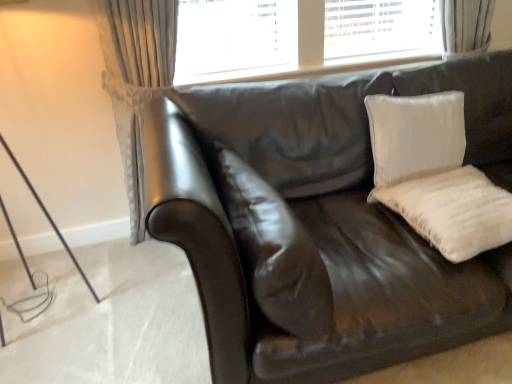
What do you see at coordinates (273, 249) in the screenshot? Image resolution: width=512 pixels, height=384 pixels. I see `satin brown pillow at center, which ranks as the third pillow in right-to-left order` at bounding box center [273, 249].

In order to face white cotton pillow at right, which appears as the 1th pillow when viewed from the right, should I rotate leftwards or rightwards?

You should look right and rotate roughly 26.079 degrees.

Identify the location of white cotton pillow at right, which appears as the 1th pillow when viewed from the right. The image size is (512, 384). (453, 211).

The width and height of the screenshot is (512, 384). Describe the element at coordinates (415, 136) in the screenshot. I see `white textured pillow at upper right, which ranks as the 2th pillow in right-to-left order` at that location.

Identify the location of satin brown pillow at center, which ranks as the third pillow in right-to-left order. This screenshot has width=512, height=384. (273, 249).

Where is `pillow below the white cotton pillow at right, which appears as the 1th pillow when viewed from the right (from the image's perspective)`? pillow below the white cotton pillow at right, which appears as the 1th pillow when viewed from the right (from the image's perspective) is located at coordinates (273, 249).

Is white cotton pillow at right, the 3th pillow when ordered from left to right, behind satin brown pillow at center, which ranks as the third pillow in right-to-left order?

Yes, it is behind satin brown pillow at center, which ranks as the third pillow in right-to-left order.

Considering the relative sizes of white cotton pillow at right, which appears as the 1th pillow when viewed from the right, and satin brown pillow at center, the 1th pillow from the left, in the image provided, is white cotton pillow at right, which appears as the 1th pillow when viewed from the right, thinner than satin brown pillow at center, the 1th pillow from the left,?

No.

Is point (443, 214) closer or farther from the camera than point (300, 328)?

Point (443, 214) appears to be farther away from the viewer than point (300, 328).

Is shiny brown leather couch at center surrounding white cotton pillow at right, which appears as the 1th pillow when viewed from the right?

Yes, white cotton pillow at right, which appears as the 1th pillow when viewed from the right, is a part of shiny brown leather couch at center.

Looking at this image, does shiny brown leather couch at center appear on the right side of white cotton pillow at right, which appears as the 1th pillow when viewed from the right?

Incorrect, shiny brown leather couch at center is not on the right side of white cotton pillow at right, which appears as the 1th pillow when viewed from the right.

What's the angular difference between shiny brown leather couch at center and white cotton pillow at right, the 3th pillow when ordered from left to right,'s facing directions?

shiny brown leather couch at center and white cotton pillow at right, the 3th pillow when ordered from left to right, are facing 2.5e-05 degrees away from each other.

Is shiny brown leather couch at center behind white cotton pillow at right, which appears as the 1th pillow when viewed from the right?

No, shiny brown leather couch at center is closer to the viewer.

The image size is (512, 384). Find the location of `studio couch that appears above the white cotton pillow at right, the 3th pillow when ordered from left to right (from the image's perspective)`. studio couch that appears above the white cotton pillow at right, the 3th pillow when ordered from left to right (from the image's perspective) is located at coordinates (353, 216).

Looking at the image, does white cotton pillow at right, which appears as the 1th pillow when viewed from the right, seem bigger or smaller compared to shiny brown leather couch at center?

Considering their sizes, white cotton pillow at right, which appears as the 1th pillow when viewed from the right, takes up less space than shiny brown leather couch at center.

From a real-world perspective, is white cotton pillow at right, which appears as the 1th pillow when viewed from the right, physically above shiny brown leather couch at center?

Yes, from a real-world perspective, white cotton pillow at right, which appears as the 1th pillow when viewed from the right, is above shiny brown leather couch at center.

Is shiny brown leather couch at center located outside white textured pillow at upper right, which ranks as the 2th pillow in right-to-left order?

shiny brown leather couch at center lies outside white textured pillow at upper right, which ranks as the 2th pillow in right-to-left order,'s area.

Which of these two, shiny brown leather couch at center or white textured pillow at upper right, which ranks as the 2th pillow in right-to-left order, stands taller?

Standing taller between the two is shiny brown leather couch at center.

Who is smaller, shiny brown leather couch at center or white textured pillow at upper right, which ranks as the 2th pillow in right-to-left order?

Smaller between the two is white textured pillow at upper right, which ranks as the 2th pillow in right-to-left order.

Would you say white textured pillow at upper right, acting as the 2th pillow starting from the left, is to the left or to the right of satin brown pillow at center, which ranks as the third pillow in right-to-left order, in the picture?

In the image, white textured pillow at upper right, acting as the 2th pillow starting from the left, appears on the right side of satin brown pillow at center, which ranks as the third pillow in right-to-left order.

How many degrees apart are the facing directions of white textured pillow at upper right, which ranks as the 2th pillow in right-to-left order, and satin brown pillow at center, which ranks as the third pillow in right-to-left order?

The facing directions of white textured pillow at upper right, which ranks as the 2th pillow in right-to-left order, and satin brown pillow at center, which ranks as the third pillow in right-to-left order, are 90 degrees apart.

Is point (464, 148) in front of point (329, 324)?

No, it is behind (329, 324).

From the image's perspective, is white textured pillow at upper right, which ranks as the 2th pillow in right-to-left order, on top of satin brown pillow at center, the 1th pillow from the left?

Yes, from the image's perspective, white textured pillow at upper right, which ranks as the 2th pillow in right-to-left order, is over satin brown pillow at center, the 1th pillow from the left.

Is white textured pillow at upper right, which ranks as the 2th pillow in right-to-left order, closer to camera compared to shiny brown leather couch at center?

No, white textured pillow at upper right, which ranks as the 2th pillow in right-to-left order, is behind shiny brown leather couch at center.

You are a GUI agent. You are given a task and a screenshot of the screen. Output one action in this format:
    pyautogui.click(x=<x>, y=<y>)
    Task: Click on the studio couch on the left of white textured pillow at upper right, acting as the 2th pillow starting from the left
    The height and width of the screenshot is (384, 512).
    Given the screenshot: What is the action you would take?
    pyautogui.click(x=353, y=216)

From a real-world perspective, is white textured pillow at upper right, which ranks as the 2th pillow in right-to-left order, physically located above or below shiny brown leather couch at center?

white textured pillow at upper right, which ranks as the 2th pillow in right-to-left order, is above shiny brown leather couch at center.

Is white textured pillow at upper right, which ranks as the 2th pillow in right-to-left order, facing towards shiny brown leather couch at center?

Yes, white textured pillow at upper right, which ranks as the 2th pillow in right-to-left order, is facing shiny brown leather couch at center.

Considering the positions of objects satin brown pillow at center, which ranks as the third pillow in right-to-left order, and white textured pillow at upper right, acting as the 2th pillow starting from the left, in the image provided, who is behind, satin brown pillow at center, which ranks as the third pillow in right-to-left order, or white textured pillow at upper right, acting as the 2th pillow starting from the left,?

white textured pillow at upper right, acting as the 2th pillow starting from the left, is more distant.

Based on the photo, which point is more forward, [316,332] or [401,140]?

The point [316,332] is closer.

Does satin brown pillow at center, which ranks as the third pillow in right-to-left order, have a larger size compared to white textured pillow at upper right, which ranks as the 2th pillow in right-to-left order?

Correct, satin brown pillow at center, which ranks as the third pillow in right-to-left order, is larger in size than white textured pillow at upper right, which ranks as the 2th pillow in right-to-left order.

The image size is (512, 384). Identify the location of pillow that is under the satin brown pillow at center, which ranks as the third pillow in right-to-left order (from a real-world perspective). (453, 211).

Image resolution: width=512 pixels, height=384 pixels. What are the coordinates of `pillow that is the 1st one when counting downward from the shiny brown leather couch at center (from the image's perspective)` in the screenshot? It's located at (453, 211).

In the scene shown: Looking at the image, which one is located closer to satin brown pillow at center, the 1th pillow from the left, shiny brown leather couch at center or white textured pillow at upper right, acting as the 2th pillow starting from the left?

Among the two, shiny brown leather couch at center is located nearer to satin brown pillow at center, the 1th pillow from the left.

In the scene shown: Considering their positions, is white textured pillow at upper right, acting as the 2th pillow starting from the left, positioned further to satin brown pillow at center, which ranks as the third pillow in right-to-left order, than shiny brown leather couch at center?

Based on the image, white textured pillow at upper right, acting as the 2th pillow starting from the left, appears to be further to satin brown pillow at center, which ranks as the third pillow in right-to-left order.

Considering their positions, is shiny brown leather couch at center positioned further to white textured pillow at upper right, acting as the 2th pillow starting from the left, than white cotton pillow at right, which appears as the 1th pillow when viewed from the right?

The object further to white textured pillow at upper right, acting as the 2th pillow starting from the left, is shiny brown leather couch at center.

Looking at the image, which one is located closer to white textured pillow at upper right, acting as the 2th pillow starting from the left, white cotton pillow at right, the 3th pillow when ordered from left to right, or satin brown pillow at center, the 1th pillow from the left?

white cotton pillow at right, the 3th pillow when ordered from left to right, is closer to white textured pillow at upper right, acting as the 2th pillow starting from the left.

Estimate the real-world distances between objects in this image. Which object is further from shiny brown leather couch at center, white cotton pillow at right, the 3th pillow when ordered from left to right, or white textured pillow at upper right, acting as the 2th pillow starting from the left?

white textured pillow at upper right, acting as the 2th pillow starting from the left.

Looking at the image, which one is located closer to shiny brown leather couch at center, satin brown pillow at center, which ranks as the third pillow in right-to-left order, or white textured pillow at upper right, acting as the 2th pillow starting from the left?

satin brown pillow at center, which ranks as the third pillow in right-to-left order.

Based on their spatial positions, is satin brown pillow at center, the 1th pillow from the left, or white cotton pillow at right, which appears as the 1th pillow when viewed from the right, closer to white textured pillow at upper right, which ranks as the 2th pillow in right-to-left order?

Based on the image, white cotton pillow at right, which appears as the 1th pillow when viewed from the right, appears to be nearer to white textured pillow at upper right, which ranks as the 2th pillow in right-to-left order.

Based on their spatial positions, is satin brown pillow at center, which ranks as the third pillow in right-to-left order, or shiny brown leather couch at center further from white textured pillow at upper right, acting as the 2th pillow starting from the left?

satin brown pillow at center, which ranks as the third pillow in right-to-left order, is further to white textured pillow at upper right, acting as the 2th pillow starting from the left.

You are a GUI agent. You are given a task and a screenshot of the screen. Output one action in this format:
    pyautogui.click(x=<x>, y=<y>)
    Task: Click on the pillow between satin brown pillow at center, which ranks as the third pillow in right-to-left order, and white cotton pillow at right, which appears as the 1th pillow when viewed from the right
    
    Given the screenshot: What is the action you would take?
    pyautogui.click(x=415, y=136)

You are a GUI agent. You are given a task and a screenshot of the screen. Output one action in this format:
    pyautogui.click(x=<x>, y=<y>)
    Task: Click on the studio couch located between satin brown pillow at center, the 1th pillow from the left, and white cotton pillow at right, which appears as the 1th pillow when viewed from the right, in the left-right direction
    Image resolution: width=512 pixels, height=384 pixels.
    Given the screenshot: What is the action you would take?
    pyautogui.click(x=353, y=216)